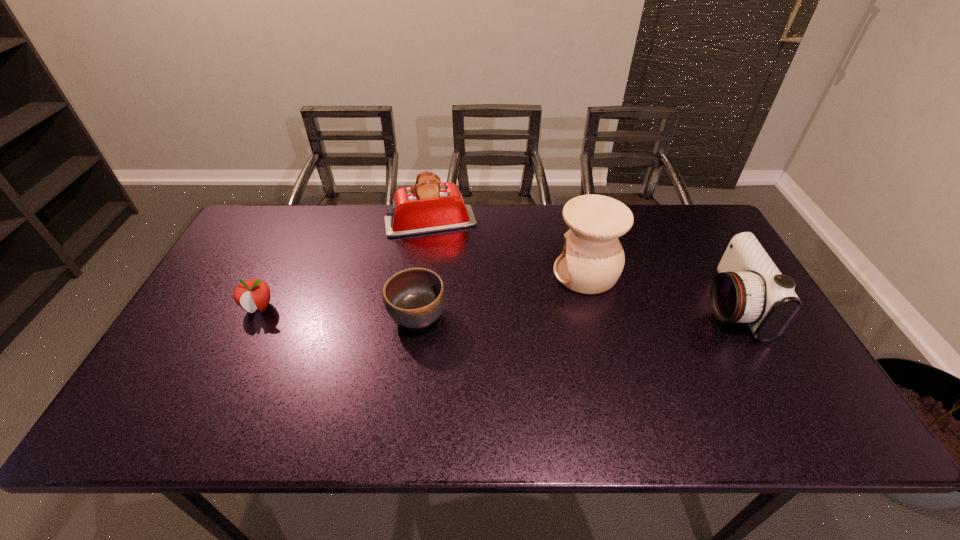
Identify which object is the closest to the apple. Please provide its 2D coordinates. Your answer should be formatted as a tuple, i.e. [(x, y)], where the tuple contains the x and y coordinates of a point satisfying the conditions above.

[(414, 298)]

This screenshot has height=540, width=960. In order to click on free space in the image that satisfies the following two spatial constraints: 1. on the surface of the camcorder; 2. on the front side of the apple in this screenshot , I will do `click(732, 307)`.